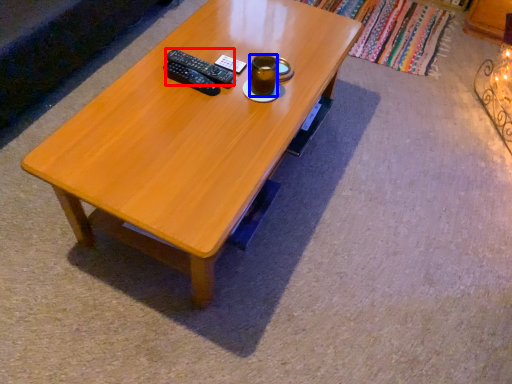
Question: Which of the following is the farthest to the observer, remote (highlighted by a red box) or beverage (highlighted by a blue box)?

Choices:
 (A) remote
 (B) beverage

Answer: (A)